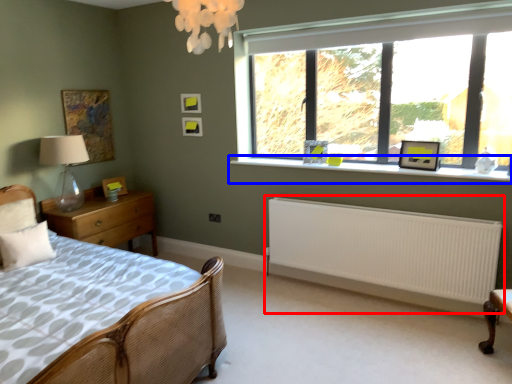
Question: Which object is closer to the camera taking this photo, radiator (highlighted by a red box) or window sill (highlighted by a blue box)?

Choices:
 (A) radiator
 (B) window sill

Answer: (A)